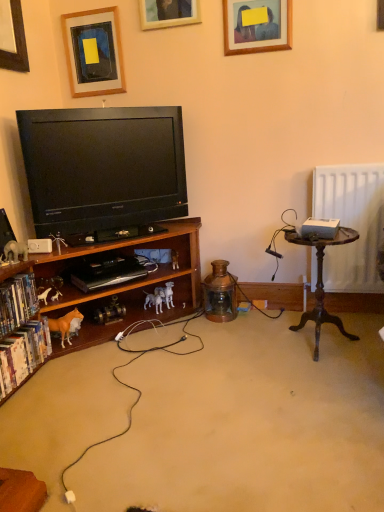
Question: Considering the relative positions of black glossy television at left and copper glass lantern at center, the second toy when ordered from back to front, in the image provided, is black glossy television at left to the left of copper glass lantern at center, the second toy when ordered from back to front, from the viewer's perspective?

Choices:
 (A) yes
 (B) no

Answer: (A)

Question: Can you confirm if black glossy television at left is shorter than copper glass lantern at center, the second toy when ordered from back to front?

Choices:
 (A) no
 (B) yes

Answer: (A)

Question: Is black glossy television at left positioned behind copper glass lantern at center, which is the first toy from right to left?

Choices:
 (A) no
 (B) yes

Answer: (A)

Question: From the image's perspective, is black glossy television at left over copper glass lantern at center, acting as the 4th toy starting from the left?

Choices:
 (A) yes
 (B) no

Answer: (A)

Question: Is black glossy television at left not within copper glass lantern at center, acting as the 4th toy starting from the left?

Choices:
 (A) yes
 (B) no

Answer: (A)

Question: Is black glossy television at left taller than copper glass lantern at center, which is the first toy from right to left?

Choices:
 (A) yes
 (B) no

Answer: (A)

Question: Can you confirm if copper glass lantern at center, the third toy when ordered from front to back, is bigger than wooden vintage table at right?

Choices:
 (A) no
 (B) yes

Answer: (A)

Question: Is copper glass lantern at center, the third toy when ordered from front to back, located outside wooden vintage table at right?

Choices:
 (A) no
 (B) yes

Answer: (B)

Question: Is copper glass lantern at center, the third toy when ordered from front to back, wider than wooden vintage table at right?

Choices:
 (A) no
 (B) yes

Answer: (A)

Question: Considering the relative sizes of copper glass lantern at center, the third toy when ordered from front to back, and wooden vintage table at right in the image provided, is copper glass lantern at center, the third toy when ordered from front to back, smaller than wooden vintage table at right?

Choices:
 (A) yes
 (B) no

Answer: (A)

Question: From the image's perspective, would you say copper glass lantern at center, which is the first toy from right to left, is positioned over wooden vintage table at right?

Choices:
 (A) yes
 (B) no

Answer: (B)

Question: Is the depth of copper glass lantern at center, acting as the 4th toy starting from the left, greater than that of wooden vintage table at right?

Choices:
 (A) yes
 (B) no

Answer: (A)

Question: Considering the relative positions of wooden picture frame at upper center, positioned as the 3th picture frame in left-to-right order, and white plastic speaker at lower left in the image provided, is wooden picture frame at upper center, positioned as the 3th picture frame in left-to-right order, to the right of white plastic speaker at lower left from the viewer's perspective?

Choices:
 (A) no
 (B) yes

Answer: (B)